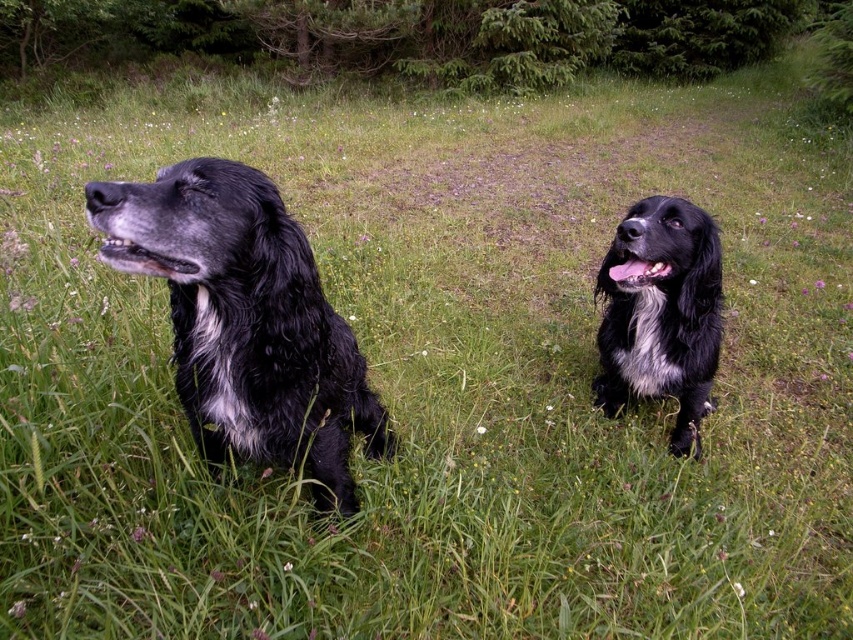
Who is higher up, shiny black fur at left or black fluffy dog at right?

black fluffy dog at right is higher up.

Is point (357, 416) less distant than point (693, 253)?

No, it is behind (693, 253).

Where is `shiny black fur at left`? shiny black fur at left is located at coordinates (245, 321).